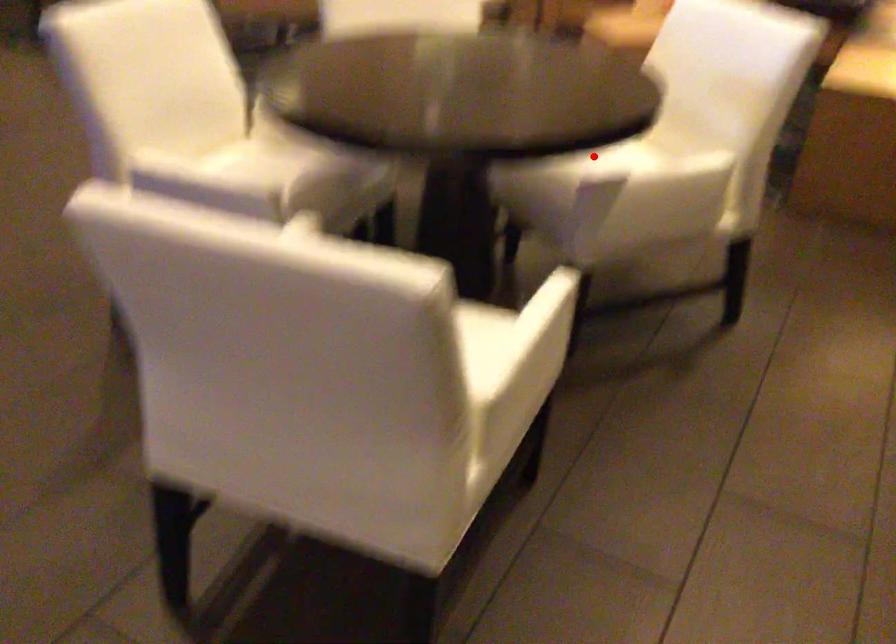
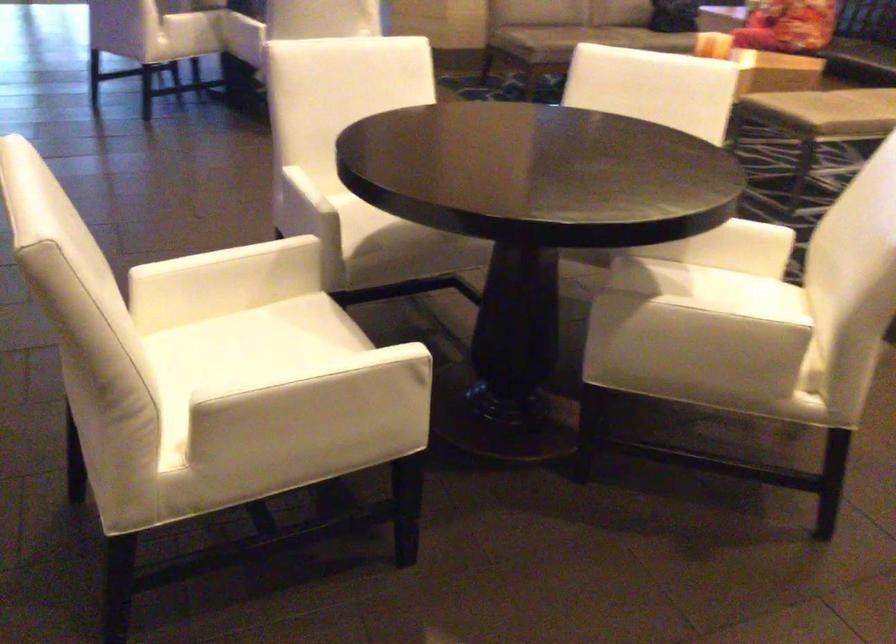
Question: I am providing you with two images of the same scene from different viewpoints. A red point is shown in image1. For the corresponding object point in image2, is it positioned nearer or farther from the camera?

Choices:
 (A) Nearer
 (B) Farther

Answer: (A)